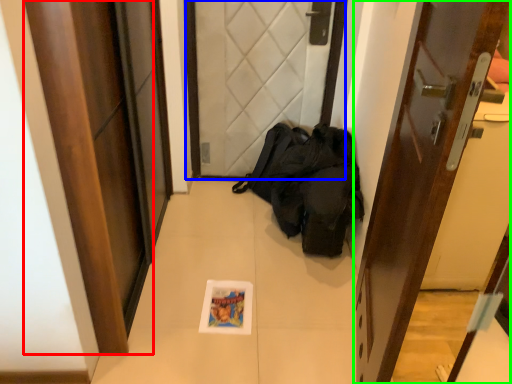
Question: Considering the real-world distances, which object is closest to door (highlighted by a red box)? door (highlighted by a blue box) or door (highlighted by a green box).

Choices:
 (A) door
 (B) door

Answer: (B)